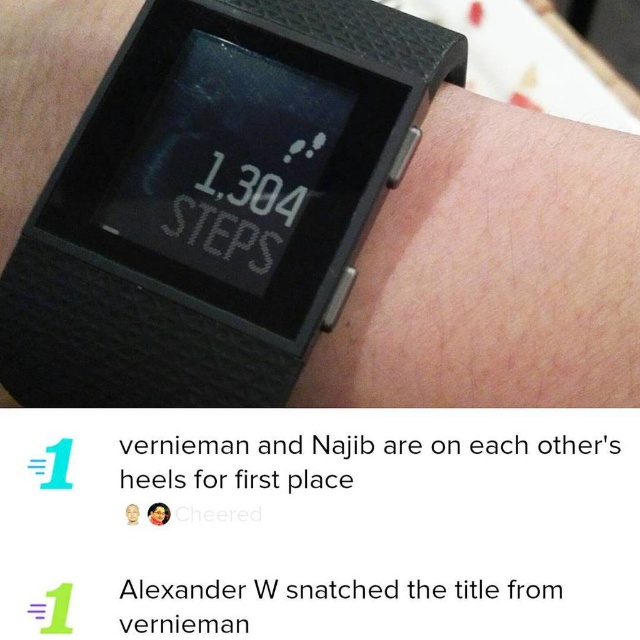
Measure the distance between black matte watch at upper center and matte black watch at upper center.

The distance of black matte watch at upper center from matte black watch at upper center is 7.62 inches.

Which of these two, black matte watch at upper center or matte black watch at upper center, stands taller?

With more height is black matte watch at upper center.

Does point (76, 154) lie behind point (436, 276)?

Yes, it is.

The width and height of the screenshot is (640, 640). Identify the location of black matte watch at upper center. (214, 200).